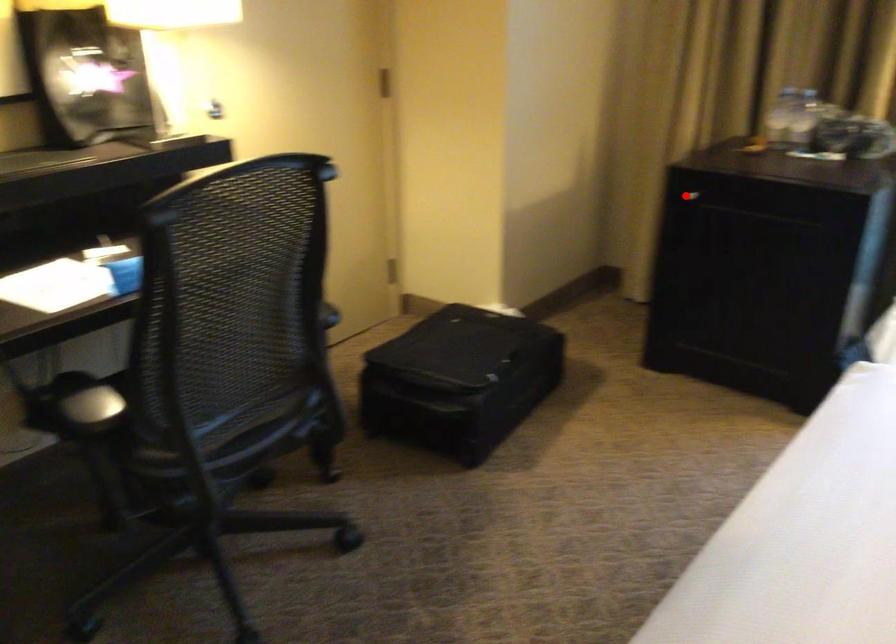
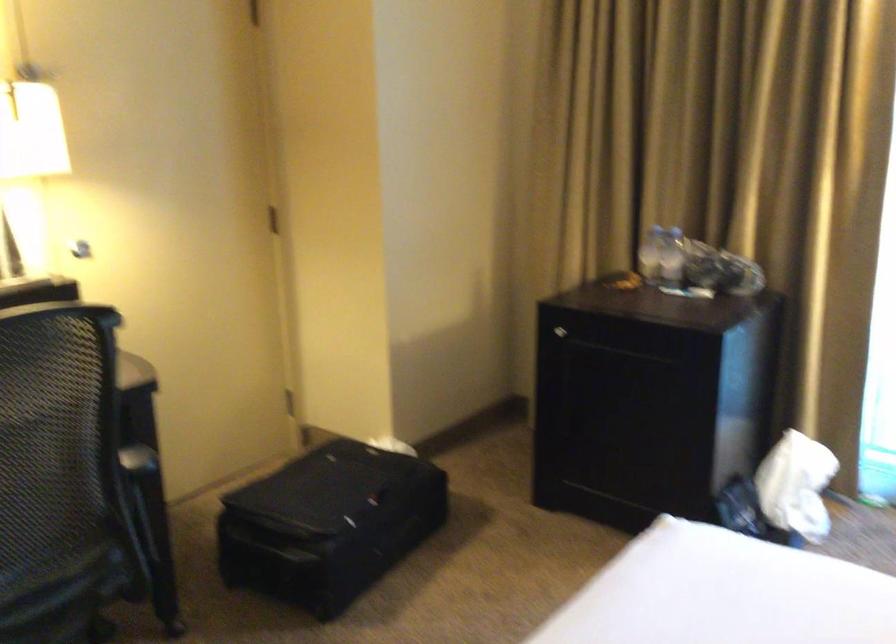
The point at the highlighted location is marked in the first image. Where is the corresponding point in the second image?

(560, 330)